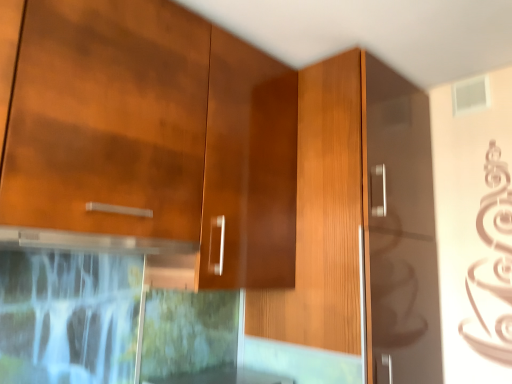
Describe the element at coordinates (149, 140) in the screenshot. The image size is (512, 384). I see `matte wood cabinet at upper left` at that location.

What is the approximate width of matte wood cabinet at upper left?

The width of matte wood cabinet at upper left is 15.31 inches.

At what (x,y) coordinates should I click in order to perform the action: click on matte wood cabinet at upper left. Please return your answer as a coordinate pair (x, y). The width and height of the screenshot is (512, 384). Looking at the image, I should click on (149, 140).

I want to click on matte wood cabinet at upper left, so click(x=149, y=140).